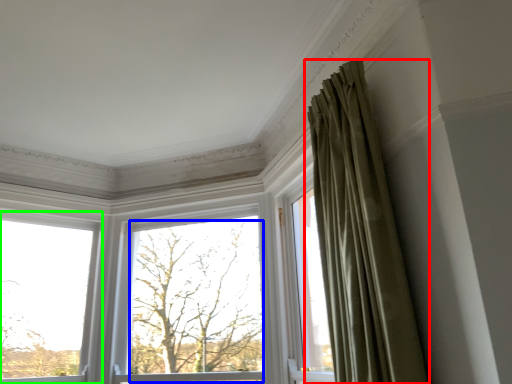
Question: Estimate the real-world distances between objects in this image. Which object is closer to curtain (highlighted by a red box), tree (highlighted by a blue box) or window (highlighted by a green box)?

Choices:
 (A) tree
 (B) window

Answer: (A)